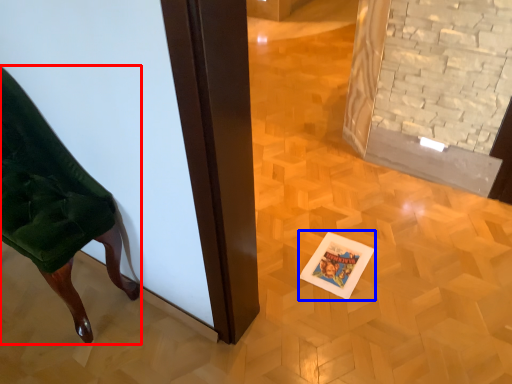
Question: Which object is further to the camera taking this photo, furniture (highlighted by a red box) or postcard (highlighted by a blue box)?

Choices:
 (A) furniture
 (B) postcard

Answer: (B)